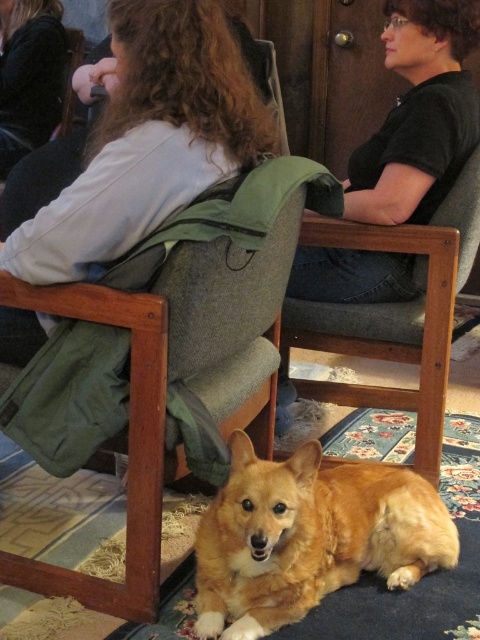
Question: Which object is closer to the camera taking this photo?

Choices:
 (A) light gray sweater at upper left
 (B) black cotton shirt at upper center
 (C) golden fur dog at lower center
 (D) wooden chair at center

Answer: (C)

Question: Which object is closer to the camera taking this photo?

Choices:
 (A) light gray sweater at upper left
 (B) golden fur dog at lower center

Answer: (B)

Question: Is golden fur dog at lower center to the right of light gray sweater at upper left from the viewer's perspective?

Choices:
 (A) no
 (B) yes

Answer: (B)

Question: Considering the real-world distances, which object is closest to the golden fur dog at lower center?

Choices:
 (A) wooden chair at center
 (B) black cotton shirt at upper center
 (C) dark brown hair at upper left

Answer: (A)

Question: Considering the relative positions of light gray sweater at upper left and dark brown hair at upper left in the image provided, where is light gray sweater at upper left located with respect to dark brown hair at upper left?

Choices:
 (A) below
 (B) above

Answer: (A)

Question: Can you confirm if golden fur dog at lower center is positioned below light gray sweater at upper left?

Choices:
 (A) no
 (B) yes

Answer: (B)